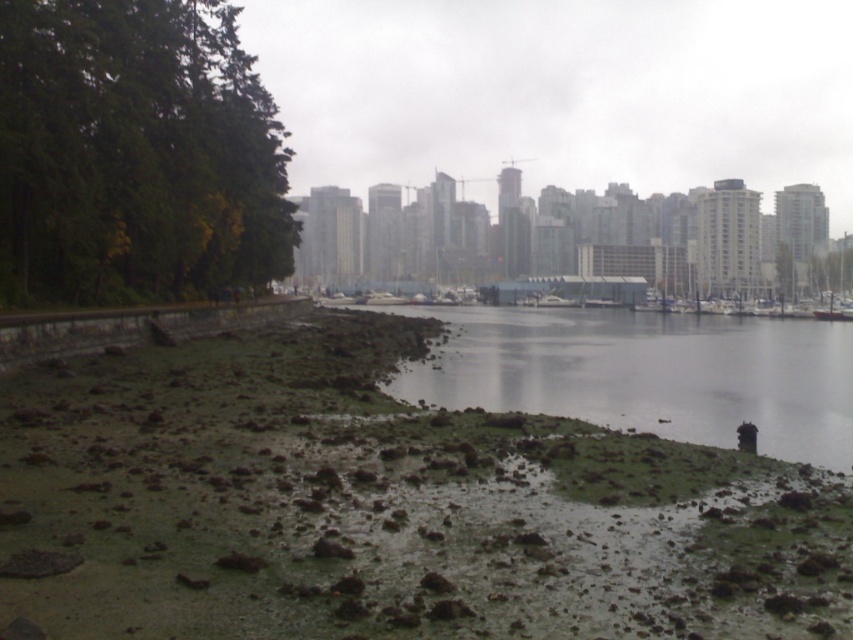
You are standing at the shoreline and want to walk to the green mossy mud at lower center. Which direction should you head towards relative to the green leafy trees at left?

You should head to the right of the green leafy trees at left because the green mossy mud at lower center is located to the right of them.